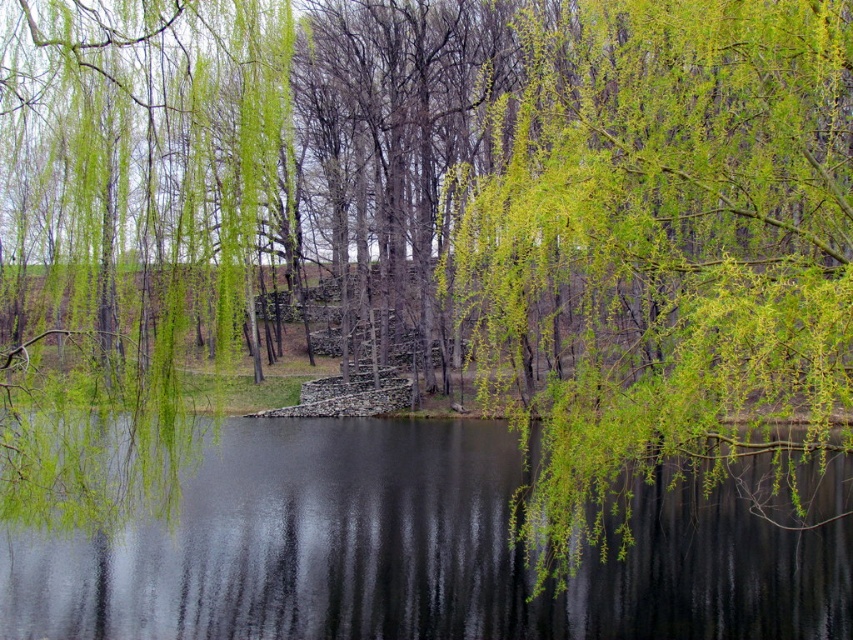
Question: Which object is closer to the camera taking this photo?

Choices:
 (A) transparent water at center
 (B) green leafy willow at upper right

Answer: (B)

Question: Which point appears farthest from the camera in this image?

Choices:
 (A) (599, 600)
 (B) (270, 150)
 (C) (575, 291)

Answer: (B)

Question: Which object is the farthest from the transparent water at center?

Choices:
 (A) green leafy willow at center
 (B) green leafy willow at upper right

Answer: (A)

Question: Is green leafy willow at upper right in front of transparent water at center?

Choices:
 (A) no
 (B) yes

Answer: (B)

Question: Can you confirm if green leafy willow at upper right is positioned to the right of transparent water at center?

Choices:
 (A) yes
 (B) no

Answer: (A)

Question: Does transparent water at center have a lesser width compared to green leafy willow at center?

Choices:
 (A) no
 (B) yes

Answer: (A)